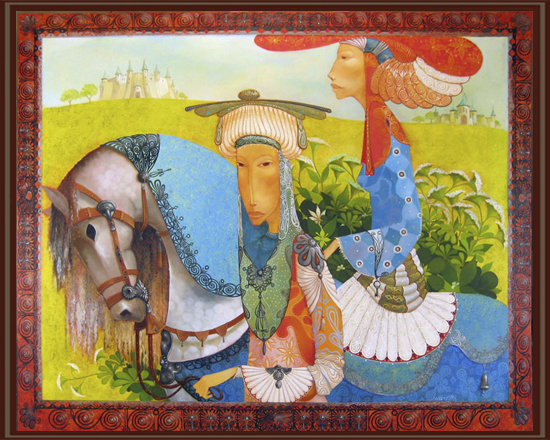
The width and height of the screenshot is (550, 440). Find the location of `frame`. frame is located at coordinates (11, 371), (153, 404), (514, 256), (314, 14).